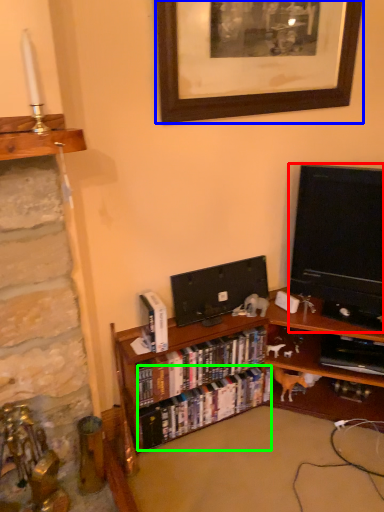
Question: Based on their relative distances, which object is farther from television (highlighted by a red box)? Choose from picture frame (highlighted by a blue box) and book (highlighted by a green box).

Choices:
 (A) picture frame
 (B) book

Answer: (B)